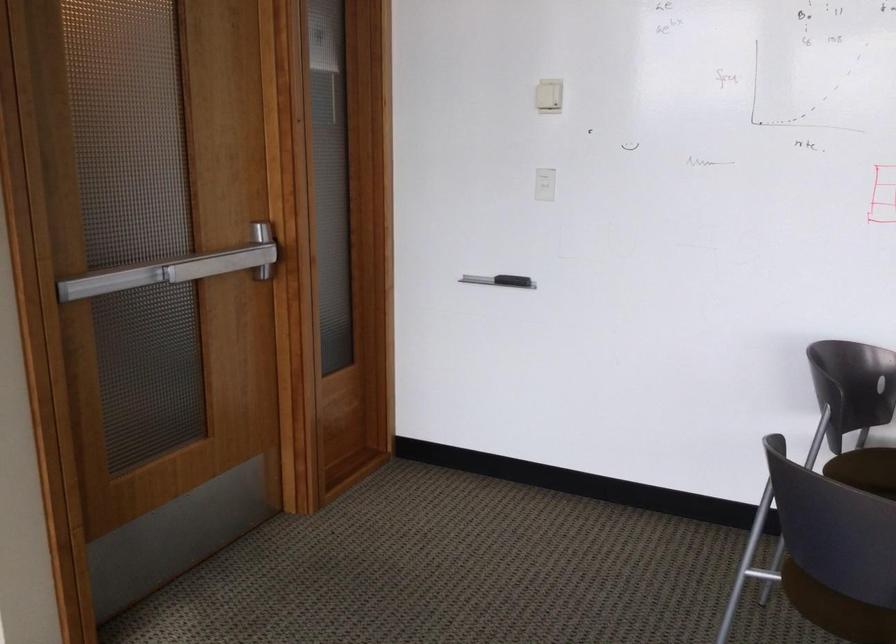
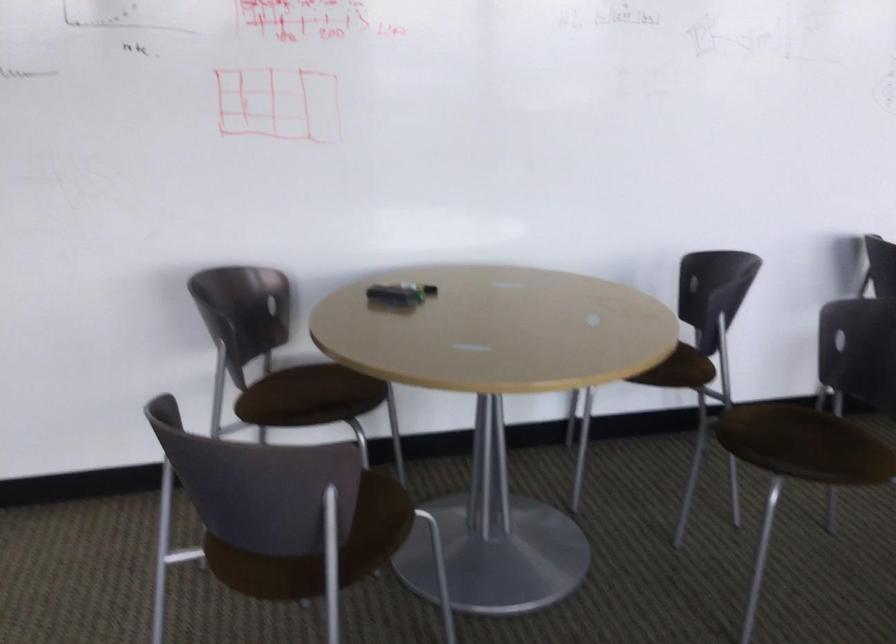
Question: The camera is either moving clockwise (left) or counter-clockwise (right) around the object. The first image is from the beginning of the video and the second image is from the end. Is the camera moving left or right when shooting the video?

Choices:
 (A) Left
 (B) Right

Answer: (A)